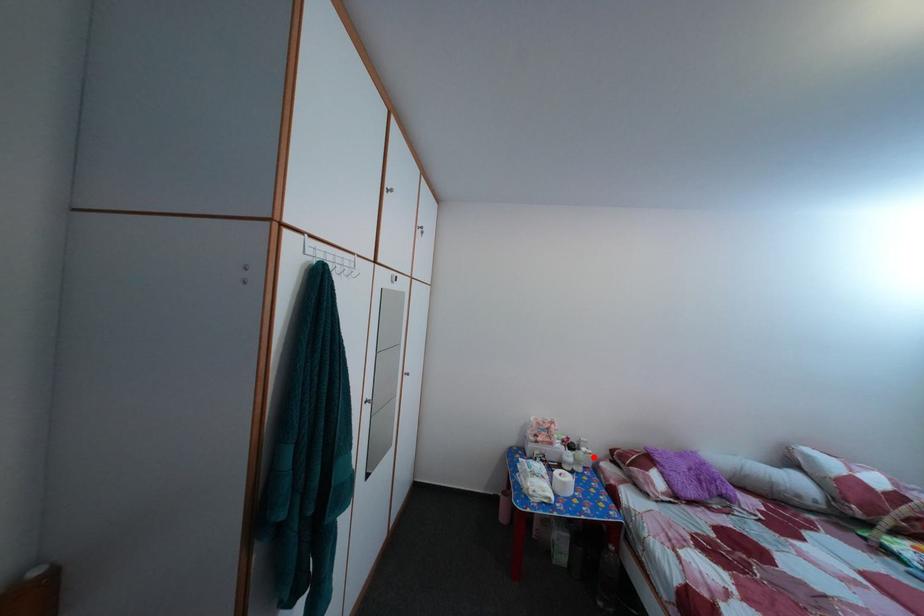
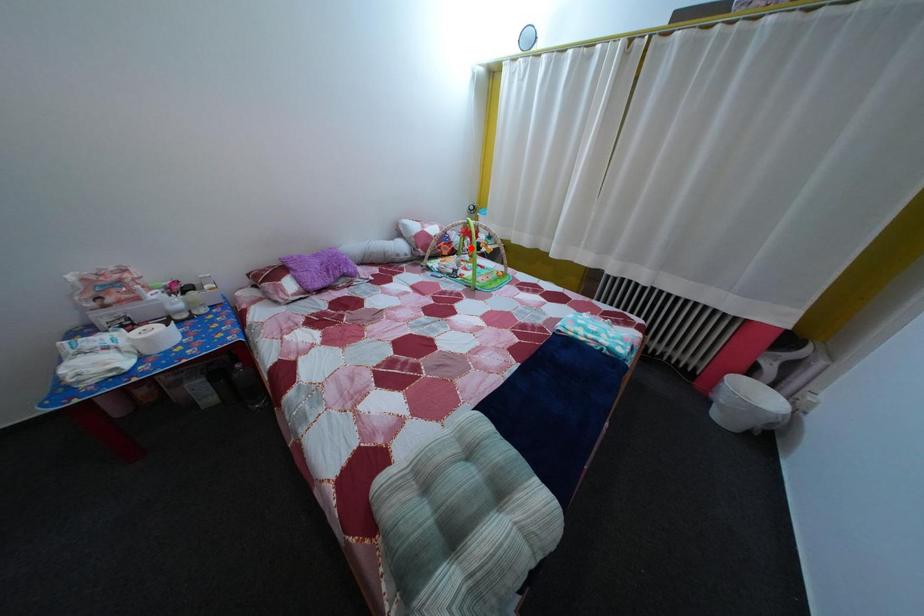
I am providing you with two images of the same scene from different viewpoints. A red point is marked on the first image and another point is marked on the second image. Does the point marked in image1 correspond to the same location as the one in image2?

No